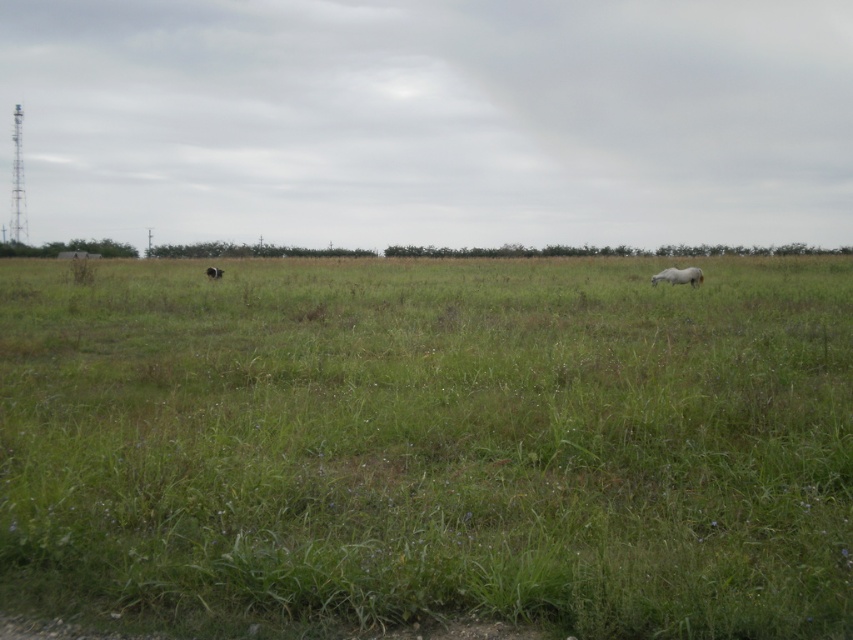
You are a photographer trying to capture the white fluffy horse at center and the green grass at center in a single shot. Based on their positions, which object is closer to the left edge of your camera frame?

The green grass at center is to the left of the white fluffy horse at center, so the green grass at center would be closer to the left edge of the camera frame.

You are a photographer trying to capture the white fluffy horse at center from above the green grass at center. Is this possible given their positions?

The green grass at center is positioned under the white fluffy horse at center, so yes, you can capture the white fluffy horse at center from above the green grass at center since it is located directly above it.